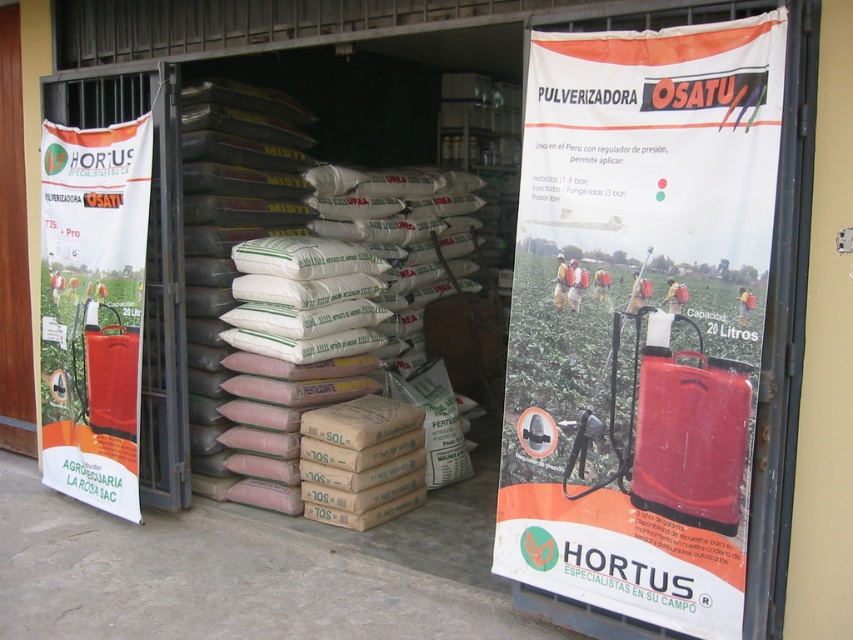
Question: Does orange plastic poster at right have a greater width compared to white paper poster at left?

Choices:
 (A) yes
 (B) no

Answer: (B)

Question: Can you confirm if orange plastic poster at right is wider than white paper poster at left?

Choices:
 (A) yes
 (B) no

Answer: (B)

Question: Which object appears farthest from the camera in this image?

Choices:
 (A) orange plastic poster at right
 (B) white paper poster at left

Answer: (B)

Question: Which point is farther from the camera taking this photo?

Choices:
 (A) (566, 420)
 (B) (62, 170)

Answer: (B)

Question: Does orange plastic poster at right have a lesser width compared to white paper poster at left?

Choices:
 (A) yes
 (B) no

Answer: (A)